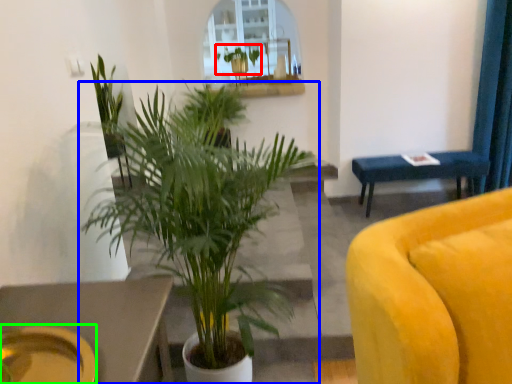
Question: Which is nearer to the houseplant (highlighted by a red box)? houseplant (highlighted by a blue box) or platter (highlighted by a green box).

Choices:
 (A) houseplant
 (B) platter

Answer: (A)